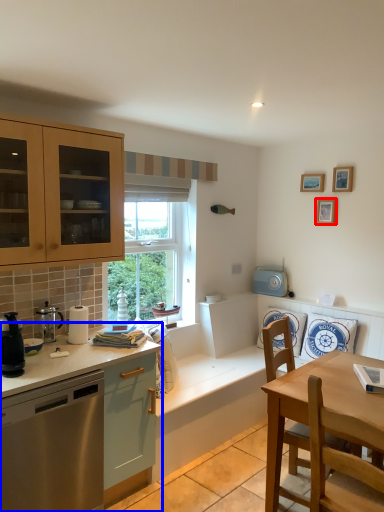
Question: Which of the following is the farthest to the observer, picture frame (highlighted by a red box) or countertop (highlighted by a blue box)?

Choices:
 (A) picture frame
 (B) countertop

Answer: (A)